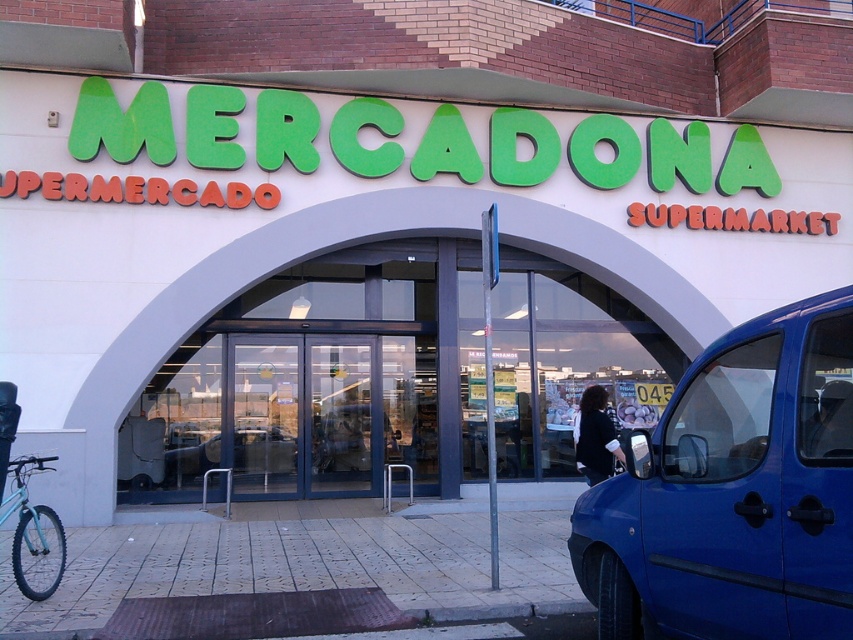
Question: Which point is closer to the camera?

Choices:
 (A) light blue matte bicycle at lower left
 (B) white/glass storefront at center

Answer: (A)

Question: Is blue metallic van at right to the right of light blue matte bicycle at lower left from the viewer's perspective?

Choices:
 (A) no
 (B) yes

Answer: (B)

Question: Observing the image, what is the correct spatial positioning of white/glass storefront at center in reference to blue metallic van at right?

Choices:
 (A) left
 (B) right

Answer: (A)

Question: Which object appears farthest from the camera in this image?

Choices:
 (A) white/glass storefront at center
 (B) light blue matte bicycle at lower left
 (C) blue metallic van at right

Answer: (A)

Question: Can you confirm if white/glass storefront at center is smaller than blue metallic van at right?

Choices:
 (A) yes
 (B) no

Answer: (B)

Question: Which object appears closest to the camera in this image?

Choices:
 (A) light blue matte bicycle at lower left
 (B) white/glass storefront at center

Answer: (A)